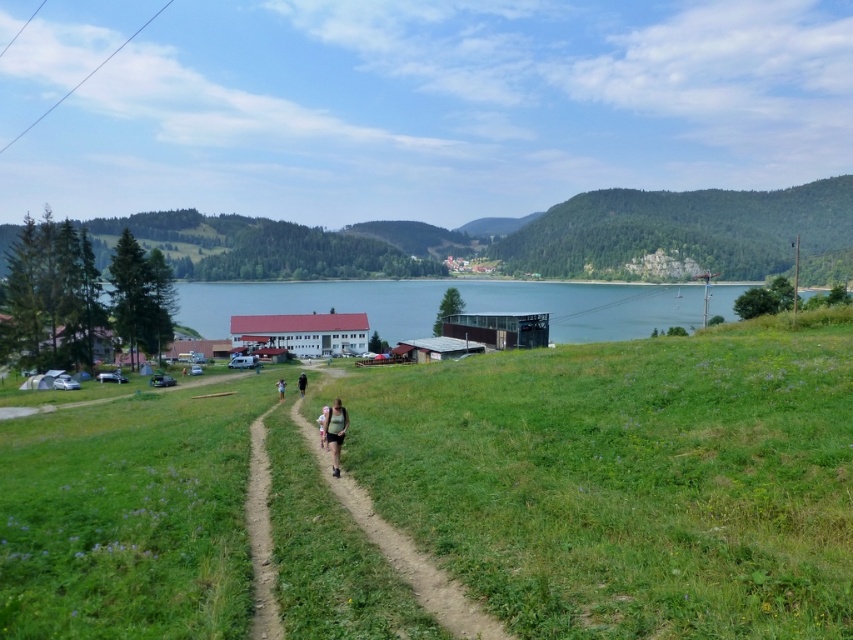
Does green forested hillside at upper right have a lesser height compared to black fabric person at center?

No.

Locate an element on the screen. green forested hillside at upper right is located at coordinates (688, 234).

Image resolution: width=853 pixels, height=640 pixels. Identify the location of green forested hillside at upper right. (688, 234).

Does brown dirt path at center appear under black fabric person at center?

Incorrect, brown dirt path at center is not positioned below black fabric person at center.

Is point (509, 637) farther from viewer compared to point (305, 385)?

That is False.

Where is `brown dirt path at center`? brown dirt path at center is located at coordinates click(x=405, y=554).

In the scene shown: Which is above, green grassy field at center or matte green tank top at center?

green grassy field at center

Does green grassy field at center have a larger size compared to matte green tank top at center?

Indeed, green grassy field at center has a larger size compared to matte green tank top at center.

The width and height of the screenshot is (853, 640). Describe the element at coordinates (627, 481) in the screenshot. I see `green grassy field at center` at that location.

Where is `green grassy field at center`? Image resolution: width=853 pixels, height=640 pixels. green grassy field at center is located at coordinates (627, 481).